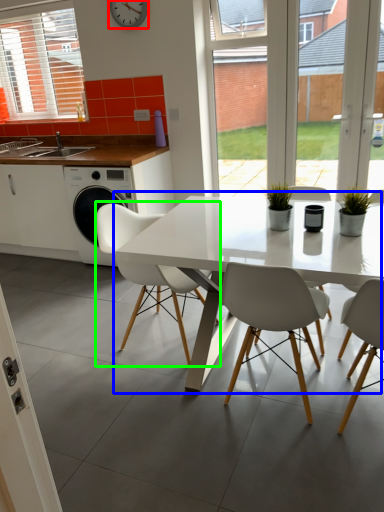
Question: Which object is the farthest from clock (highlighted by a red box)? Choose among these: kitchen & dining room table (highlighted by a blue box) or chair (highlighted by a green box).

Choices:
 (A) kitchen & dining room table
 (B) chair

Answer: (A)